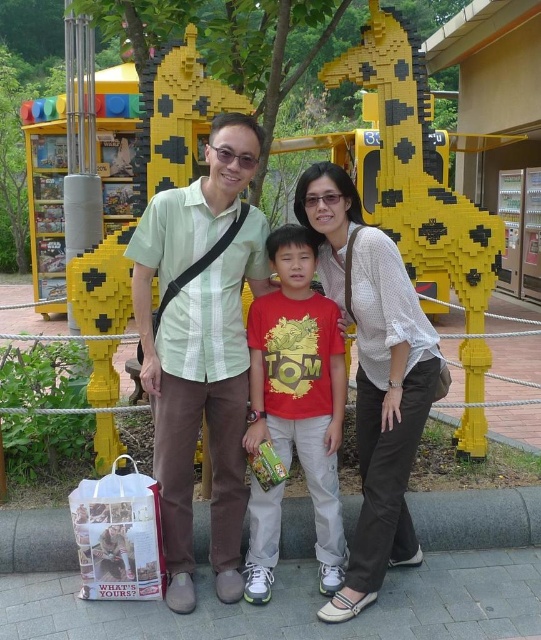
Question: Which point is farther from the camera taking this photo?

Choices:
 (A) (412, 548)
 (B) (432, 380)

Answer: (A)

Question: Which object is positioned farthest from the red matte shirt at center?

Choices:
 (A) green striped shirt at center
 (B) white dotted shirt at center
 (C) matte green shirt at center

Answer: (A)

Question: Does matte green shirt at center have a larger size compared to white dotted shirt at center?

Choices:
 (A) yes
 (B) no

Answer: (A)

Question: Is green striped shirt at center to the right of white dotted shirt at center from the viewer's perspective?

Choices:
 (A) no
 (B) yes

Answer: (A)

Question: Which point is farther to the camera?

Choices:
 (A) green striped shirt at center
 (B) matte green shirt at center
 (C) white dotted shirt at center
 (D) red matte shirt at center

Answer: (D)

Question: From the image, what is the correct spatial relationship of green striped shirt at center in relation to red matte shirt at center?

Choices:
 (A) right
 (B) left

Answer: (B)